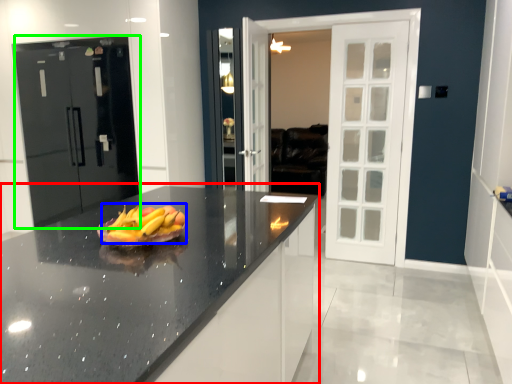
Question: Which object is positioned closest to countertop (highlighted by a red box)? Select from grapefruit (highlighted by a blue box) and door (highlighted by a green box).

Choices:
 (A) grapefruit
 (B) door

Answer: (A)